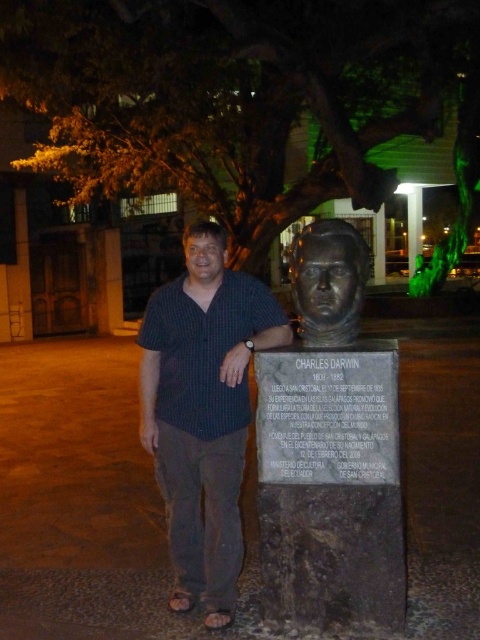
From the picture: Can you confirm if bronze bust at center is wider than dark blue shirt at center?

No, bronze bust at center is not wider than dark blue shirt at center.

Which is behind, point (267, 547) or point (155, 388)?

The point (155, 388) is behind.

Identify the location of bronze bust at center. The image size is (480, 640). (330, 449).

What do you see at coordinates (204, 352) in the screenshot? This screenshot has width=480, height=640. I see `dark blue checkered shirt at center` at bounding box center [204, 352].

Which is below, dark blue checkered shirt at center or bronze statue at center?

Positioned lower is dark blue checkered shirt at center.

The width and height of the screenshot is (480, 640). Find the location of `dark blue checkered shirt at center`. dark blue checkered shirt at center is located at coordinates (204, 352).

Between dark blue shirt at center and dark blue checkered shirt at center, which one has more height?

With more height is dark blue shirt at center.

Which is below, dark blue shirt at center or dark blue checkered shirt at center?

dark blue shirt at center is below.

Locate an element on the screen. dark blue shirt at center is located at coordinates (203, 412).